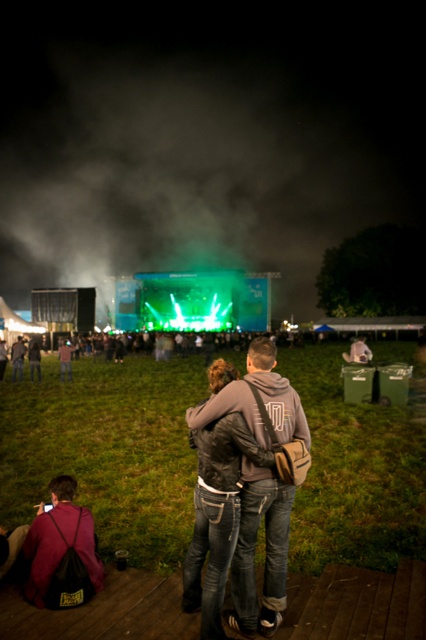
Question: Is maroon fabric jacket at lower left wider than dark gray hoodie at center?

Choices:
 (A) yes
 (B) no

Answer: (B)

Question: Estimate the real-world distances between objects in this image. Which object is closer to the denim jacket at center?

Choices:
 (A) dark gray hoodie at center
 (B) maroon fabric jacket at lower left

Answer: (B)

Question: Is maroon fabric jacket at lower left closer to the viewer compared to dark gray hoodie at center?

Choices:
 (A) yes
 (B) no

Answer: (A)

Question: Which object appears farthest from the camera in this image?

Choices:
 (A) dark gray hoodie at center
 (B) maroon fabric jacket at lower left

Answer: (A)

Question: Based on their relative distances, which object is nearer to the denim jacket at center?

Choices:
 (A) maroon fabric jacket at lower left
 (B) dark gray hoodie at center

Answer: (A)

Question: Does maroon fabric jacket at lower left appear over dark gray hoodie at center?

Choices:
 (A) yes
 (B) no

Answer: (B)